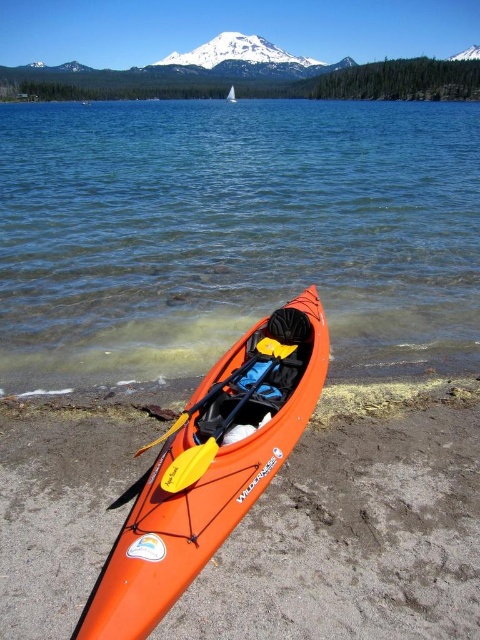
You are planning to store both the orange plastic kayak at lower center and the orange plastic kayak at center in a storage room. The storage room has a width of 1.5 meters. Which kayak can fit through the doorway if the doorway is exactly 1.5 meters wide?

The orange plastic kayak at center can fit through the doorway since its width is smaller than the orange plastic kayak at lower center, and the doorway is 1.5 meters wide.

You are a photographer setting up a tripod to capture the kayak and its accessories. You notice two yellow paddles at center. Which paddle is closer to the camera, the yellow plastic paddle at center or the yellow foam paddle at center?

The yellow plastic paddle at center is closer to the camera because the yellow foam paddle at center is positioned behind it.

You are an outdoor equipment inspector checking the kayak. You need to determine which paddle is taller between the yellow plastic paddle at center and the yellow foam paddle at center. Which one is taller?

The yellow plastic paddle at center is taller than the yellow foam paddle at center according to the description.